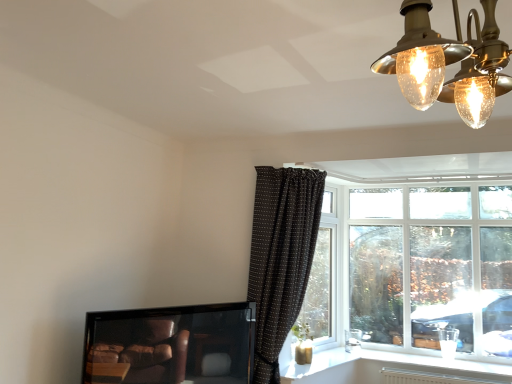
Question: From a real-world perspective, is gold textured chandelier at upper right above or below white plastic window at upper right?

Choices:
 (A) below
 (B) above

Answer: (B)

Question: Based on their sizes in the image, would you say gold textured chandelier at upper right is bigger or smaller than white plastic window at upper right?

Choices:
 (A) small
 (B) big

Answer: (A)

Question: Considering the real-world distances, which object is closest to the white plastic window sill at lower right?

Choices:
 (A) gold textured chandelier at upper right
 (B) matte black tv at lower left
 (C) white plastic window at upper right
 (D) brown dotted fabric curtain at upper center

Answer: (C)

Question: Considering the real-world distances, which object is closest to the gold textured chandelier at upper right?

Choices:
 (A) brown dotted fabric curtain at upper center
 (B) white plastic window at upper right
 (C) matte black tv at lower left
 (D) white plastic window sill at lower right

Answer: (A)